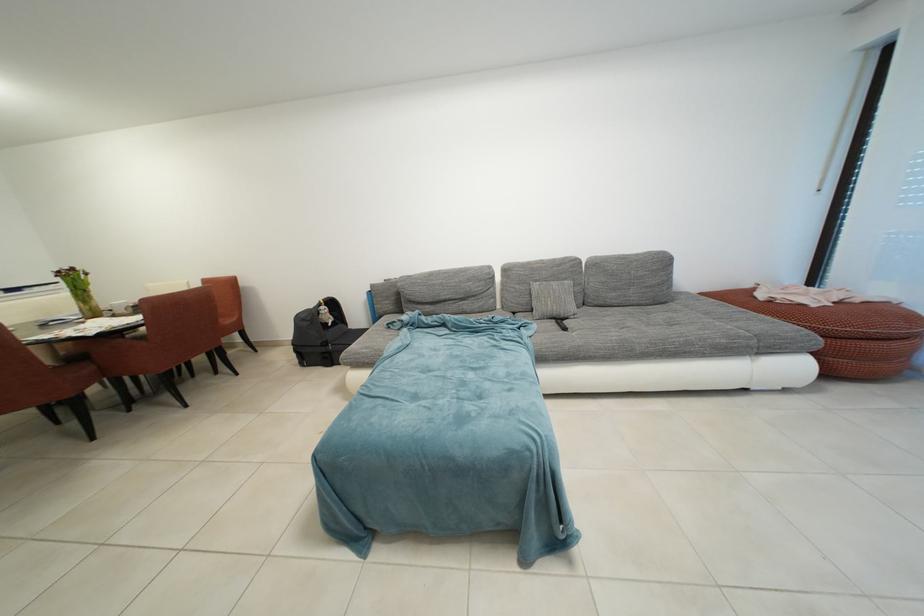
Describe the element at coordinates (625, 318) in the screenshot. I see `the grey sofa sitting surface` at that location.